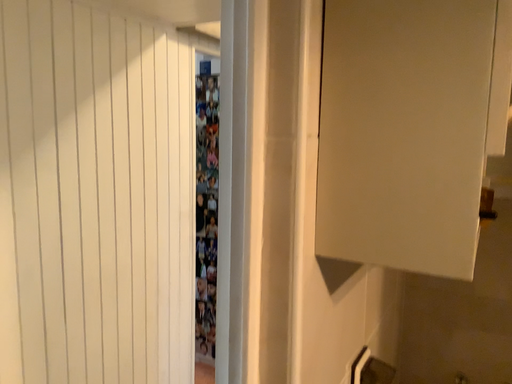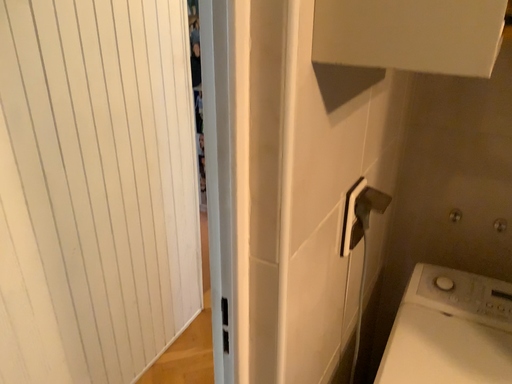
Question: How did the camera likely rotate when shooting the video?

Choices:
 (A) rotated upward
 (B) rotated downward

Answer: (B)